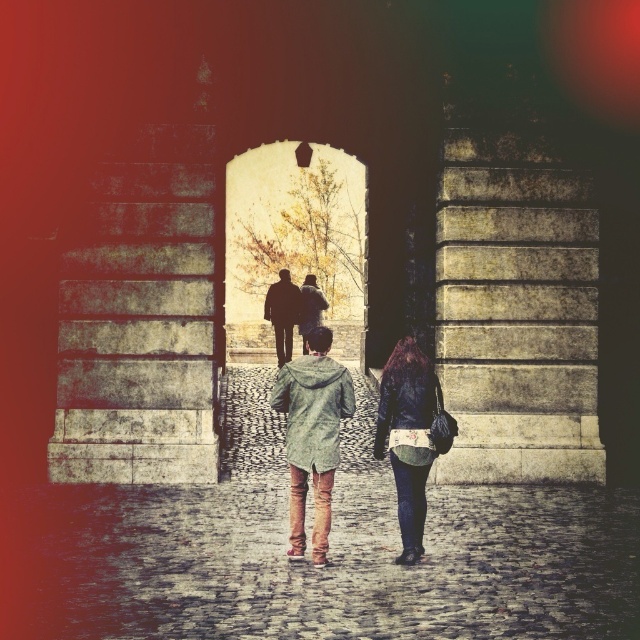
Is green textured coat at center bigger than silhouette leather jacket at center?

No.

Who is positioned more to the left, green textured coat at center or silhouette leather jacket at center?

silhouette leather jacket at center is more to the left.

Image resolution: width=640 pixels, height=640 pixels. What do you see at coordinates (312, 435) in the screenshot?
I see `green textured coat at center` at bounding box center [312, 435].

Identify the location of green textured coat at center. (312, 435).

Describe the element at coordinates (312, 435) in the screenshot. This screenshot has width=640, height=640. I see `green textured coat at center` at that location.

Which is above, green textured coat at center or leather jacket at center?

Positioned higher is green textured coat at center.

This screenshot has height=640, width=640. What are the coordinates of `green textured coat at center` in the screenshot? It's located at (312, 435).

Where is `green textured coat at center`? green textured coat at center is located at coordinates (312, 435).

Is leather jacket at center further to the viewer compared to silhouette leather jacket at center?

No, leather jacket at center is closer to the viewer.

Who is lower down, leather jacket at center or silhouette leather jacket at center?

Positioned lower is leather jacket at center.

What do you see at coordinates (408, 436) in the screenshot? Image resolution: width=640 pixels, height=640 pixels. I see `leather jacket at center` at bounding box center [408, 436].

This screenshot has width=640, height=640. Identify the location of leather jacket at center. (408, 436).